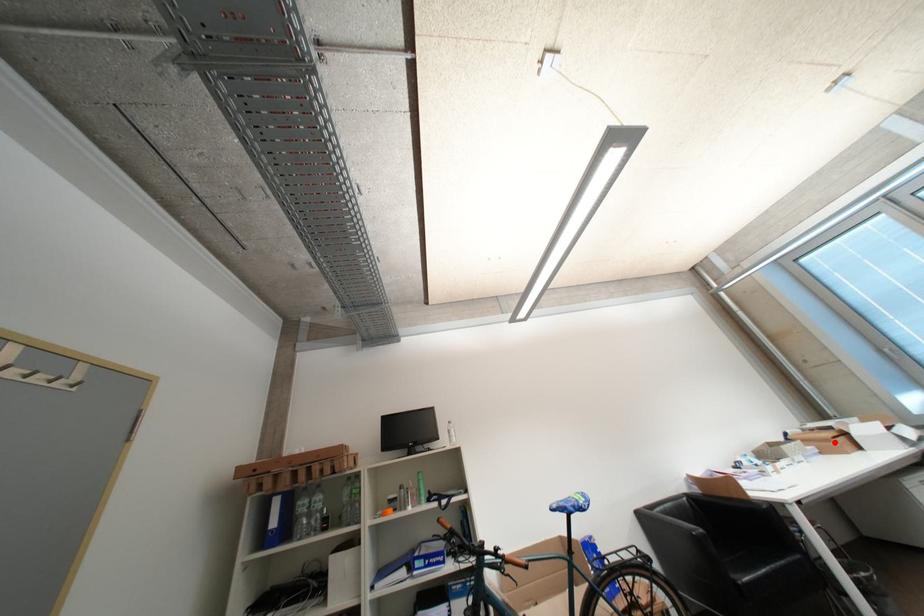
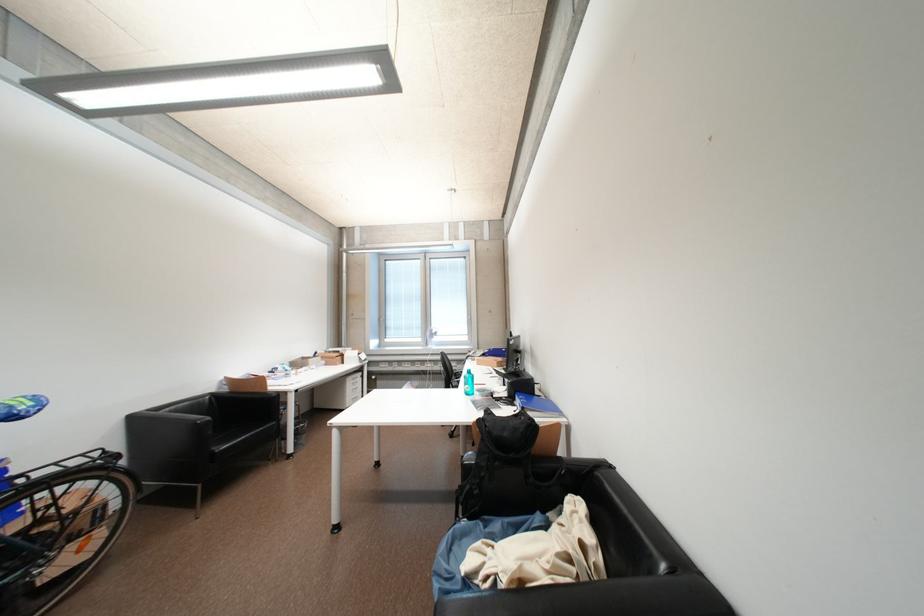
The point at the highlighted location is marked in the first image. Where is the corresponding point in the second image?

(341, 360)